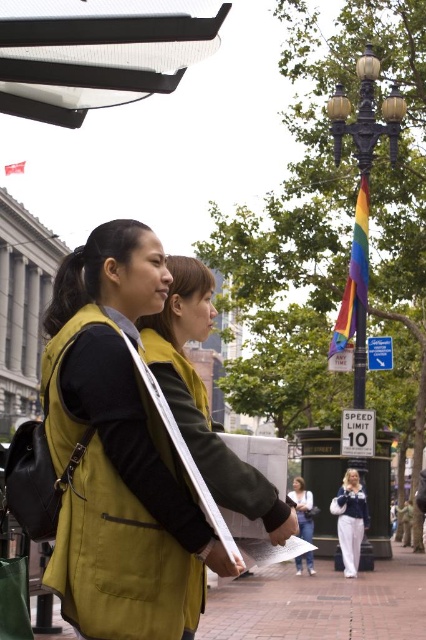
Question: Which of the following is the farthest from the observer?

Choices:
 (A) 294,563
 (B) 360,598
 (C) 158,440
 (D) 385,554

Answer: (D)

Question: In this image, where is matte yellow vest at center located relative to white matte jacket at center?

Choices:
 (A) below
 (B) above

Answer: (B)

Question: Does matte yellow vest at center have a smaller size compared to denim pants at lower center?

Choices:
 (A) yes
 (B) no

Answer: (B)

Question: Estimate the real-world distances between objects in this image. Which object is farther from the denim pants at lower center?

Choices:
 (A) white matte jacket at center
 (B) brick pavement at lower center

Answer: (B)

Question: Which point is farther from the camera taking this photo?

Choices:
 (A) (321, 481)
 (B) (293, 483)
 (C) (330, 628)

Answer: (B)

Question: Is brick pavement at lower center in front of metallic black bus stop at center?

Choices:
 (A) no
 (B) yes

Answer: (B)